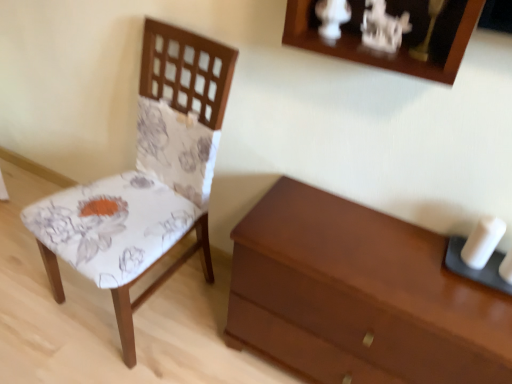
What is the approximate width of matte brown chest of drawers at lower right?

matte brown chest of drawers at lower right is 14.97 inches wide.

Find the location of a particular element. The height and width of the screenshot is (384, 512). white matte candle at right is located at coordinates (482, 242).

Relative to matte brown chest of drawers at lower right, is white matte candle at right in front or behind?

Clearly, white matte candle at right is behind matte brown chest of drawers at lower right.

From the picture: Is white matte candle at right positioned far away from matte brown chest of drawers at lower right?

No, white matte candle at right is not far away from matte brown chest of drawers at lower right.

Considering the sizes of white matte candle at right and matte brown chest of drawers at lower right in the image, is white matte candle at right wider or thinner than matte brown chest of drawers at lower right?

Clearly, white matte candle at right has less width compared to matte brown chest of drawers at lower right.

How different are the orientations of white matte candle at right and matte brown chest of drawers at lower right in degrees?

The angle between the facing direction of white matte candle at right and the facing direction of matte brown chest of drawers at lower right is 0.761 degrees.

Consider the image. Does floral fabric chair at left come in front of white matte candle at right?

That is True.

From the image's perspective, is floral fabric chair at left above or below white matte candle at right?

floral fabric chair at left is above white matte candle at right.

Is floral fabric chair at left positioned with its back to white matte candle at right?

No, white matte candle at right is not at the back of floral fabric chair at left.

Can you tell me how much matte brown chest of drawers at lower right and floral fabric chair at left differ in facing direction?

There is a 7.05-degree angle between the facing directions of matte brown chest of drawers at lower right and floral fabric chair at left.

Would you consider matte brown chest of drawers at lower right to be distant from floral fabric chair at left?

Actually, matte brown chest of drawers at lower right and floral fabric chair at left are a little close together.

Locate an element on the screen. The height and width of the screenshot is (384, 512). the chest of drawers behind the floral fabric chair at left is located at coordinates (360, 296).

Choose the correct answer: Is matte brown chest of drawers at lower right inside floral fabric chair at left or outside it?

matte brown chest of drawers at lower right exists outside the volume of floral fabric chair at left.

Considering the relative positions of white matte candle at right and floral fabric chair at left in the image provided, is white matte candle at right to the left of floral fabric chair at left from the viewer's perspective?

No.

Would you say white matte candle at right is a long distance from floral fabric chair at left?

They are positioned close to each other.

From their relative heights in the image, would you say white matte candle at right is taller or shorter than floral fabric chair at left?

In the image, white matte candle at right appears to be shorter than floral fabric chair at left.

Is white matte candle at right inside or outside of floral fabric chair at left?

white matte candle at right cannot be found inside floral fabric chair at left.

Between matte brown chest of drawers at lower right and white matte candle at right, which one has smaller size?

With smaller size is white matte candle at right.

Who is more distant, matte brown chest of drawers at lower right or white matte candle at right?

white matte candle at right is further from the camera.

Does matte brown chest of drawers at lower right contain white matte candle at right?

No.

Is floral fabric chair at left situated inside matte brown chest of drawers at lower right or outside?

floral fabric chair at left is not enclosed by matte brown chest of drawers at lower right.

Based on the photo, is floral fabric chair at left at the right side of matte brown chest of drawers at lower right?

No, floral fabric chair at left is not to the right of matte brown chest of drawers at lower right.

From a real-world perspective, between floral fabric chair at left and matte brown chest of drawers at lower right, who is vertically lower?

In real-world perspective, matte brown chest of drawers at lower right is lower.

This screenshot has height=384, width=512. What are the coordinates of `chair above the matte brown chest of drawers at lower right (from the image's perspective)` in the screenshot? It's located at (153, 169).

Locate an element on the screen. Image resolution: width=512 pixels, height=384 pixels. chest of drawers in front of the white matte candle at right is located at coordinates [x=360, y=296].

You are a GUI agent. You are given a task and a screenshot of the screen. Output one action in this format:
    pyautogui.click(x=<x>, y=<y>)
    Task: Click on the chair located on the left of white matte candle at right
    Image resolution: width=512 pixels, height=384 pixels.
    Given the screenshot: What is the action you would take?
    pyautogui.click(x=153, y=169)

Based on their spatial positions, is white matte candle at right or floral fabric chair at left closer to matte brown chest of drawers at lower right?

white matte candle at right lies closer to matte brown chest of drawers at lower right than the other object.

When comparing their distances from matte brown chest of drawers at lower right, does floral fabric chair at left or white matte candle at right seem closer?

white matte candle at right is closer to matte brown chest of drawers at lower right.

When comparing their distances from white matte candle at right, does matte brown chest of drawers at lower right or floral fabric chair at left seem closer?

The object closer to white matte candle at right is matte brown chest of drawers at lower right.

Which object lies further to the anchor point floral fabric chair at left, white matte candle at right or matte brown chest of drawers at lower right?

white matte candle at right lies further to floral fabric chair at left than the other object.

From the image, which object appears to be farther from white matte candle at right, floral fabric chair at left or matte brown chest of drawers at lower right?

floral fabric chair at left is positioned further to the anchor white matte candle at right.

Looking at the image, which one is located closer to floral fabric chair at left, matte brown chest of drawers at lower right or white matte candle at right?

matte brown chest of drawers at lower right.

Find the location of a particular element. chest of drawers between floral fabric chair at left and white matte candle at right is located at coordinates (360, 296).